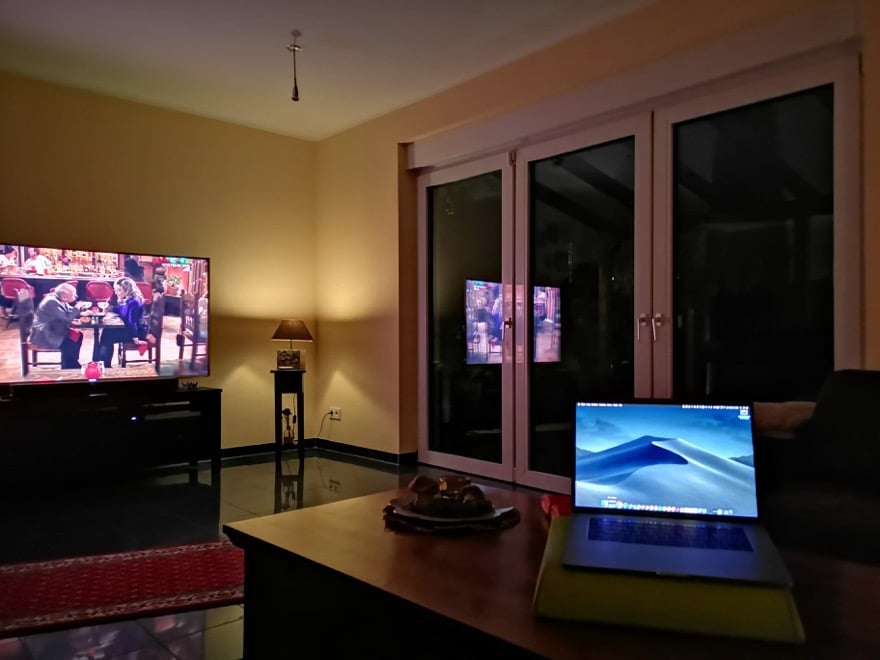
Find the location of a particular element. lamp is located at coordinates (302, 325).